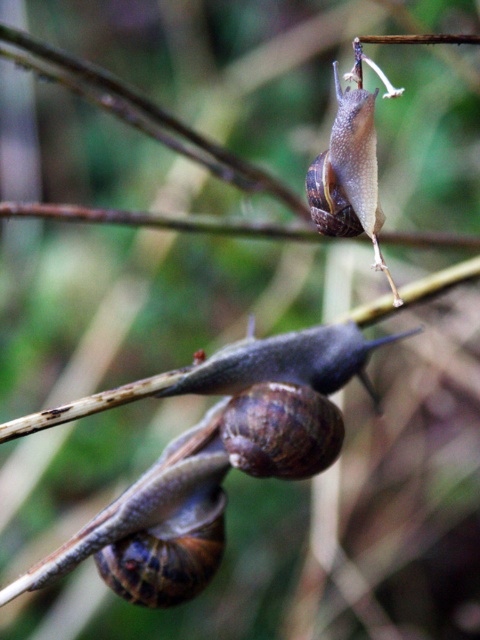
Locate an element on the screen. The height and width of the screenshot is (640, 480). brown textured snail at center is located at coordinates (210, 458).

Where is `brown textured snail at center`? brown textured snail at center is located at coordinates (210, 458).